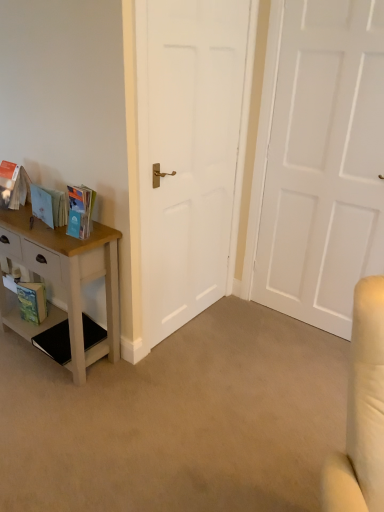
At what (x,y) coordinates should I click in order to perform the action: click on vacant space to the right of white painted wood nightstand at left. Please return your answer as a coordinate pair (x, y). The height and width of the screenshot is (512, 384). Looking at the image, I should click on (156, 376).